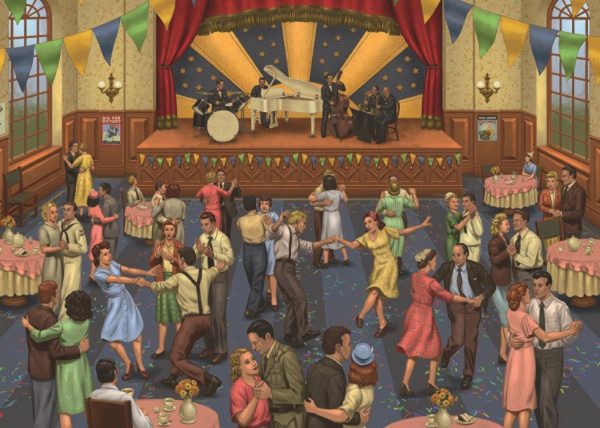
This screenshot has height=428, width=600. In order to click on stage in this screenshot , I will do `click(167, 139)`, `click(279, 142)`, `click(430, 140)`.